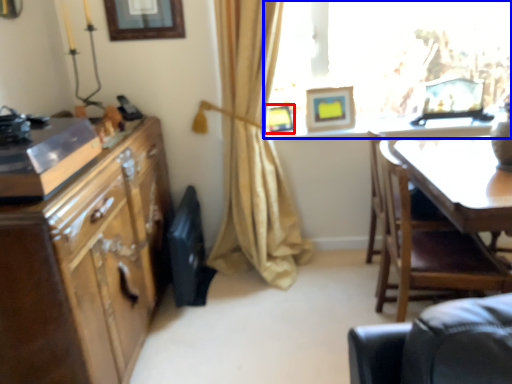
Question: Which of the following is the closest to the observer, picture frame (highlighted by a red box) or window (highlighted by a blue box)?

Choices:
 (A) picture frame
 (B) window

Answer: (B)